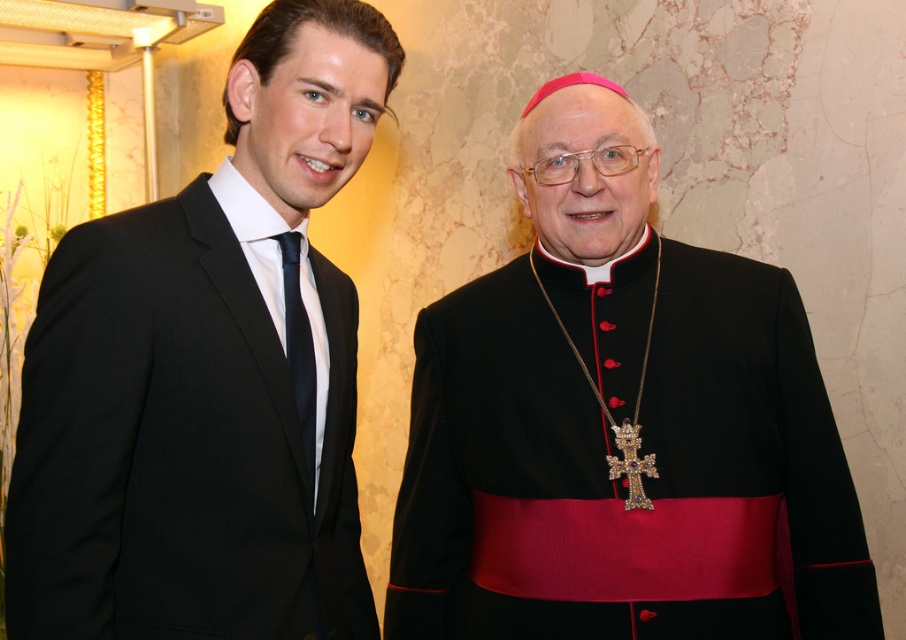
Based on the photo, you are a fashion designer observing the two black items in the image. Which one is taller between the black velvet cassock at center and the matte black tie at left?

The black velvet cassock at center is taller than the matte black tie at left.

You are a photographer preparing to take a portrait of the two individuals in the scene. You need to ensure that the black satin suit at left and the matte black tie at left are both clearly visible in the photo. Given their size relationship, which object should you focus on to ensure both are in sharp focus?

The black satin suit at left has a larger size compared to the matte black tie at left. Therefore, focusing on the larger black satin suit at left will ensure both objects are in sharp focus since depth of field is typically greater for larger objects.

You are a photographer standing 1.5 meters away from a textured beige wall. You want to take a photo of the black velvet cassock at center. Can you reach it with your hand to adjust its position without moving closer?

The black velvet cassock at center is 1.22 meters away from the viewer. Since you are standing 1.5 meters away from the wall, you cannot reach it with your hand without moving closer because the distance to the cassock is less than your standing distance from the wall.